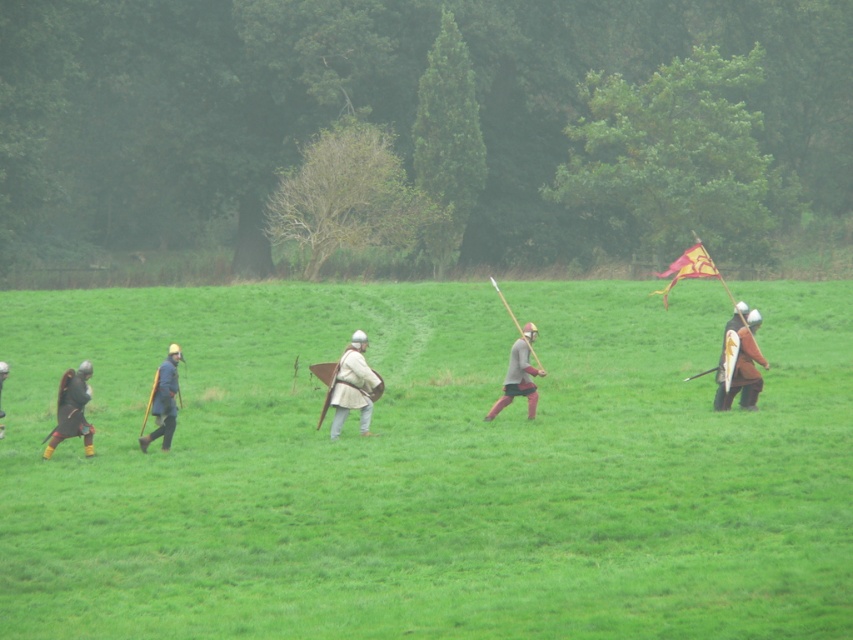
You are part of a group of medieval reenactors walking across a grassy field. You notice two individuals wearing armor. One is wearing dark brown leather armor at left, and the other has brown leather armor at center. From your perspective, which armored individual is positioned more to the left?

The dark brown leather armor at left is positioned more to the left compared to the brown leather armor at center.